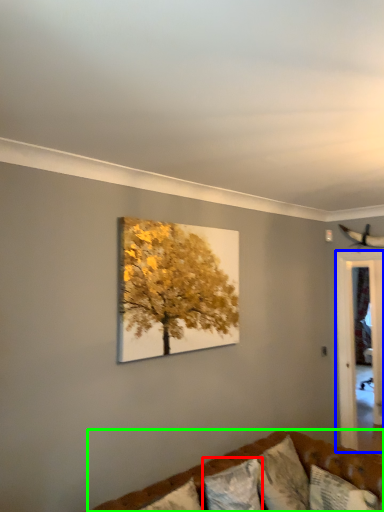
Question: Which object is the closest to the pillow (highlighted by a red box)? Choose among these: glass door (highlighted by a blue box) or studio couch (highlighted by a green box).

Choices:
 (A) glass door
 (B) studio couch

Answer: (B)